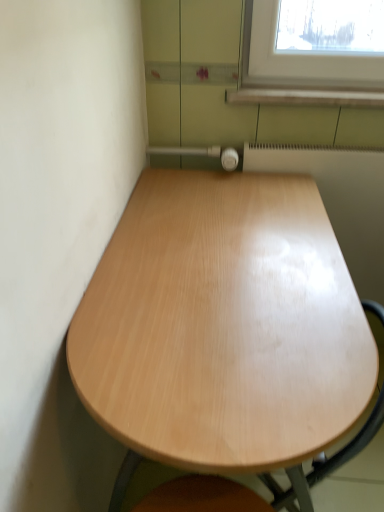
Question: Is white glossy radiator at upper right wider or thinner than light wood table at center?

Choices:
 (A) thin
 (B) wide

Answer: (A)

Question: Does point click(359, 188) appear closer or farther from the camera than point click(200, 215)?

Choices:
 (A) closer
 (B) farther

Answer: (B)

Question: Would you say white glossy radiator at upper right is inside or outside light wood table at center?

Choices:
 (A) inside
 (B) outside

Answer: (B)

Question: Based on their sizes in the image, would you say light wood table at center is bigger or smaller than white glossy radiator at upper right?

Choices:
 (A) small
 (B) big

Answer: (B)

Question: From the image's perspective, is light wood table at center positioned above or below white glossy radiator at upper right?

Choices:
 (A) above
 (B) below

Answer: (B)

Question: Is point (370, 368) closer or farther from the camera than point (362, 263)?

Choices:
 (A) farther
 (B) closer

Answer: (B)

Question: Based on their positions, is light wood table at center located to the left or right of white glossy radiator at upper right?

Choices:
 (A) right
 (B) left

Answer: (B)